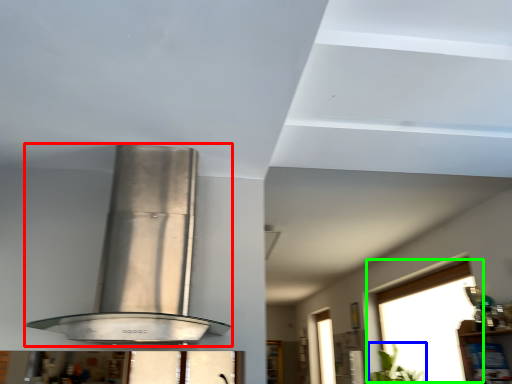
Question: Which object is the closest to the kitchen appliance (highlighted by a red box)? Choose among these: plant (highlighted by a blue box) or window (highlighted by a green box).

Choices:
 (A) plant
 (B) window

Answer: (B)